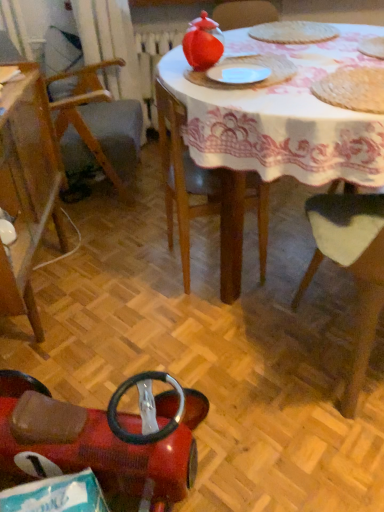
This screenshot has height=512, width=384. In order to click on empty space that is in between wooden chair at lower right, the 1th chair positioned from the right, and rubberized red toy car at lower left, the 2th chair positioned from the right in this screenshot , I will do `click(242, 394)`.